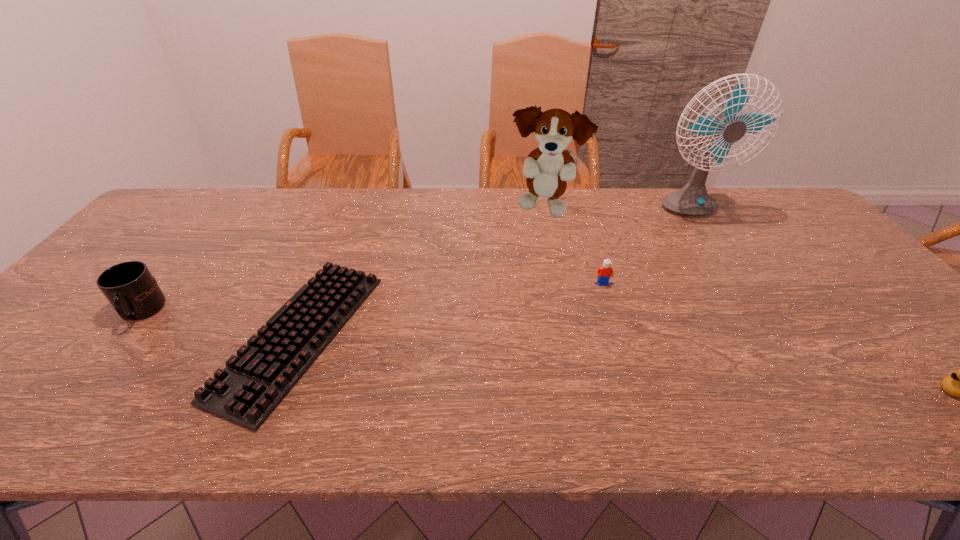
Locate an element on the screen. The width and height of the screenshot is (960, 540). unoccupied area between the second object from right to left and the computer keyboard is located at coordinates (494, 273).

Where is `vacant area that lies between the mug and the shortest object`? This screenshot has height=540, width=960. vacant area that lies between the mug and the shortest object is located at coordinates (220, 323).

At what (x,y) coordinates should I click in order to perform the action: click on free space between the fan and the Lego. Please return your answer as a coordinate pair (x, y). The width and height of the screenshot is (960, 540). Looking at the image, I should click on (645, 248).

Image resolution: width=960 pixels, height=540 pixels. Find the location of `unoccupied area between the fan and the Lego`. unoccupied area between the fan and the Lego is located at coordinates (645, 248).

You are a GUI agent. You are given a task and a screenshot of the screen. Output one action in this format:
    pyautogui.click(x=<x>, y=<y>)
    Task: Click on the free area in between the puppy and the leftmost object
    
    Given the screenshot: What is the action you would take?
    pyautogui.click(x=343, y=260)

I want to click on free spot between the fan and the Lego, so click(x=645, y=248).

What are the coordinates of `vacant area that lies between the Lego and the fifth object from left to right` in the screenshot? It's located at (645, 248).

Where is `vacant space that is in between the Lego and the shortest object`? The height and width of the screenshot is (540, 960). vacant space that is in between the Lego and the shortest object is located at coordinates pos(451,309).

Locate an element on the screen. The image size is (960, 540). free area in between the Lego and the computer keyboard is located at coordinates [451, 309].

Where is `free spot between the fan and the leftmost object`? free spot between the fan and the leftmost object is located at coordinates (415, 262).